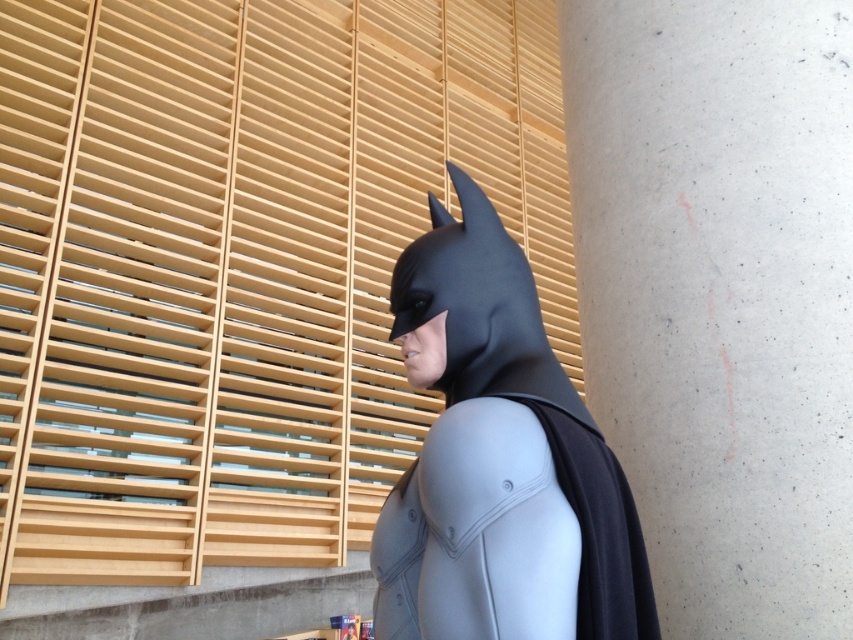
You are a photographer setting up a shoot with a Batman figure. You want to position a spotlight to the left of the matte black costume at center so it illuminates the concrete textured pillar at right. Is the spotlight placement possible without moving the Batman figure?

Yes, the spotlight can be placed to the left of the matte black costume at center because the concrete textured pillar at right is located to the right of the matte black costume at center, allowing the light to reach it.

You are a photographer setting up a shoot in the room with the Batman figure. You want to frame the matte black costume at center so that it appears wider than the concrete textured pillar at right in the photo. Is this possible? Explain why or why not based on their actual widths.

The concrete textured pillar at right is wider than the matte black costume at center. Therefore, it is not possible to make the matte black costume at center appear wider than the concrete textured pillar at right in the photo because the pillar is actually wider in reality.

You are standing in the room with the Batman figure and need to determine which of the two points, point (773, 163) or point (602, 593), is closer to you. Which point is nearer?

Point (773, 163) is further to the viewer than point (602, 593), so the closer point is point (602, 593).